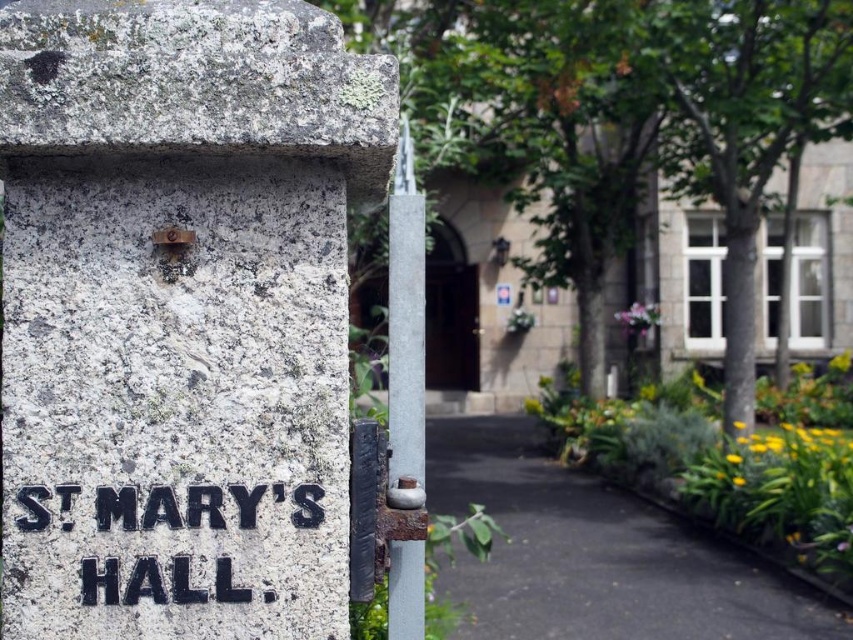
Question: Which is farther from the black cast iron sign at lower left?

Choices:
 (A) black asphalt at center
 (B) granite sign at center

Answer: (A)

Question: Can you confirm if black asphalt at center is thinner than black cast iron sign at lower left?

Choices:
 (A) no
 (B) yes

Answer: (A)

Question: Is granite sign at center above black asphalt at center?

Choices:
 (A) yes
 (B) no

Answer: (A)

Question: Among these points, which one is farthest from the camera?

Choices:
 (A) coord(180,561)
 (B) coord(325,180)
 (C) coord(587,566)

Answer: (C)

Question: Which object is closer to the camera taking this photo?

Choices:
 (A) black asphalt at center
 (B) granite sign at center

Answer: (B)

Question: Is granite sign at center below black cast iron sign at lower left?

Choices:
 (A) no
 (B) yes

Answer: (A)